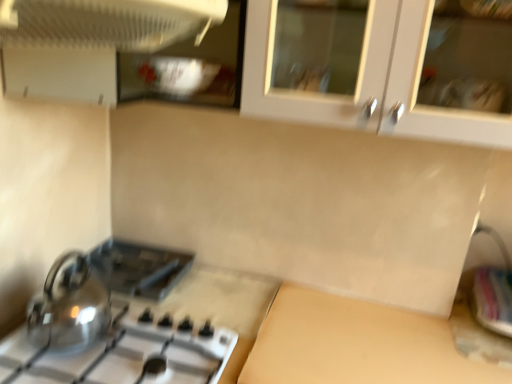
Where is `vacant space situated above beige matte counter top at lower center (from a real-world perspective)`? vacant space situated above beige matte counter top at lower center (from a real-world perspective) is located at coordinates (393, 336).